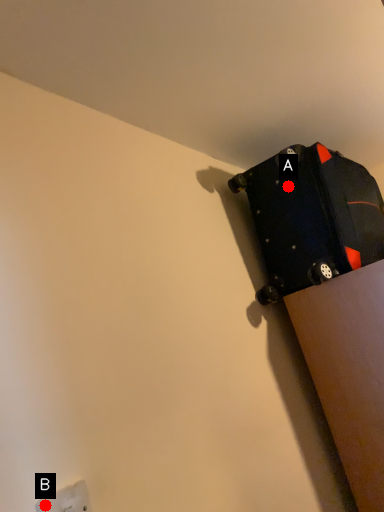
Question: Two points are circled on the image, labeled by A and B beside each circle. Which of the following is the closest to the observer?

Choices:
 (A) A is closer
 (B) B is closer

Answer: (B)